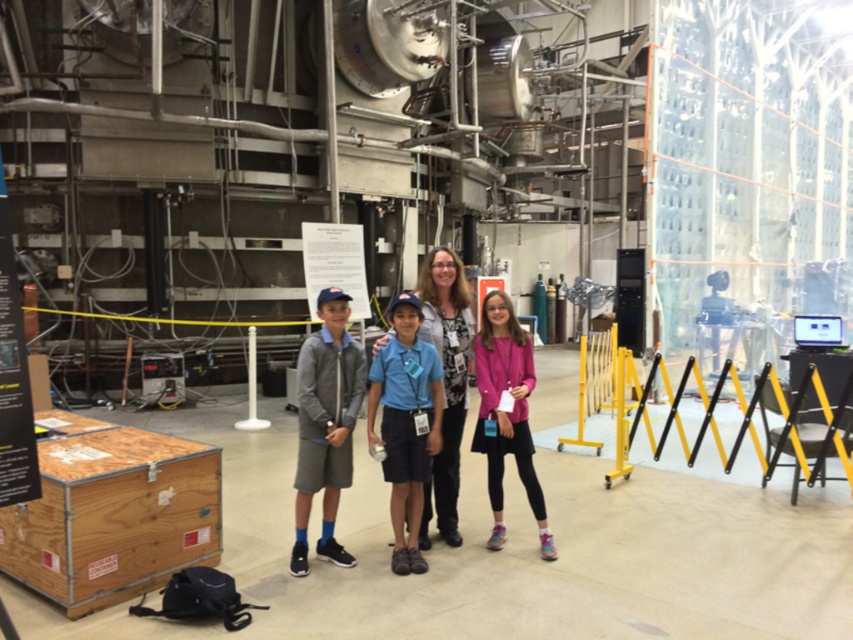
Who is shorter, gray cotton shorts at center or pink fabric jacket at center?

pink fabric jacket at center is shorter.

Between gray cotton shorts at center and pink fabric jacket at center, which one is positioned lower?

gray cotton shorts at center

Identify the location of gray cotton shorts at center. Image resolution: width=853 pixels, height=640 pixels. (325, 424).

Can you confirm if gray cotton shorts at center is positioned below matte gray sweater at center?

Yes, gray cotton shorts at center is below matte gray sweater at center.

Between point (334, 353) and point (427, 516), which one is positioned behind?

The point (427, 516) is behind.

I want to click on gray cotton shorts at center, so click(x=325, y=424).

Can you confirm if pink fabric jacket at center is wider than matte gray sweater at center?

No.

Is pink fabric jacket at center to the left of matte gray sweater at center from the viewer's perspective?

Incorrect, pink fabric jacket at center is not on the left side of matte gray sweater at center.

Which is in front, point (532, 451) or point (428, 499)?

Point (532, 451) is in front.

This screenshot has height=640, width=853. Find the location of `pink fabric jacket at center`. pink fabric jacket at center is located at coordinates (506, 412).